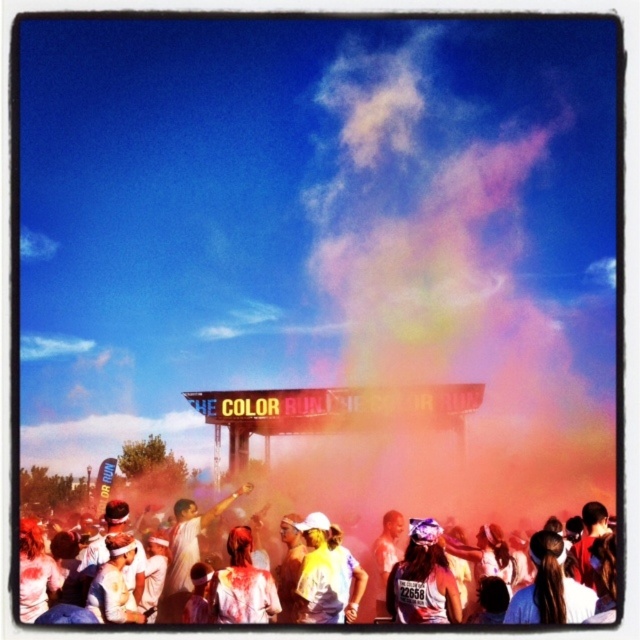
Measure the distance between point (260, 614) and camera.

The distance of point (260, 614) from camera is 150.97 meters.

Who is lower down, white matte shirt at lower center or matte white tank top at center?

matte white tank top at center is below.

Identify the location of white matte shirt at lower center. (193, 572).

You are a GUI agent. You are given a task and a screenshot of the screen. Output one action in this format:
    pyautogui.click(x=<x>, y=<y>)
    Task: Click on the white matte shirt at lower center
    
    Given the screenshot: What is the action you would take?
    pyautogui.click(x=193, y=572)